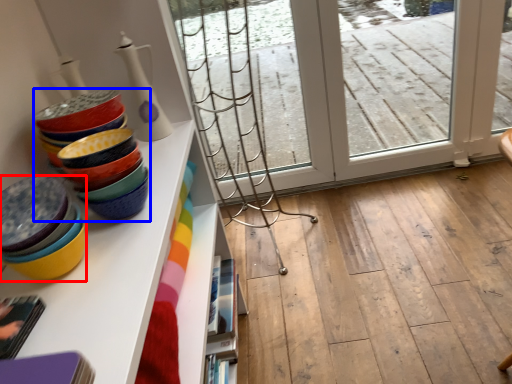
Question: Which of the following is the closest to the observer, table (highlighted by a red box) or tableware (highlighted by a blue box)?

Choices:
 (A) table
 (B) tableware

Answer: (A)